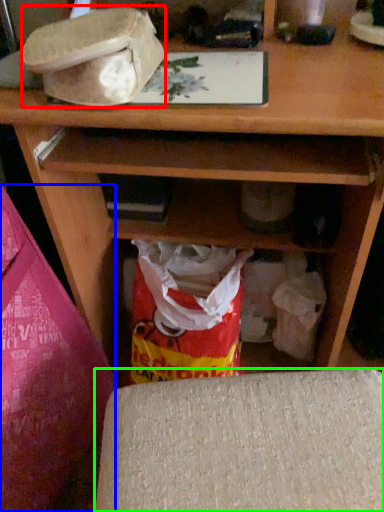
Question: Estimate the real-world distances between objects in this image. Which object is farther from hat (highlighted by a red box), leftover (highlighted by a blue box) or furniture (highlighted by a green box)?

Choices:
 (A) leftover
 (B) furniture

Answer: (B)